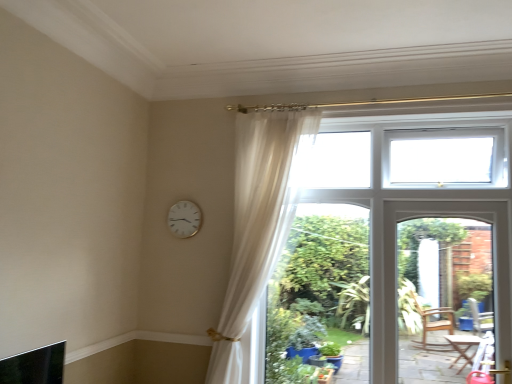
The width and height of the screenshot is (512, 384). Describe the element at coordinates (184, 219) in the screenshot. I see `white plastic clock at upper center` at that location.

What are the coordinates of `white plastic clock at upper center` in the screenshot? It's located at (184, 219).

Locate an element on the screen. This screenshot has width=512, height=384. white plastic clock at upper center is located at coordinates (184, 219).